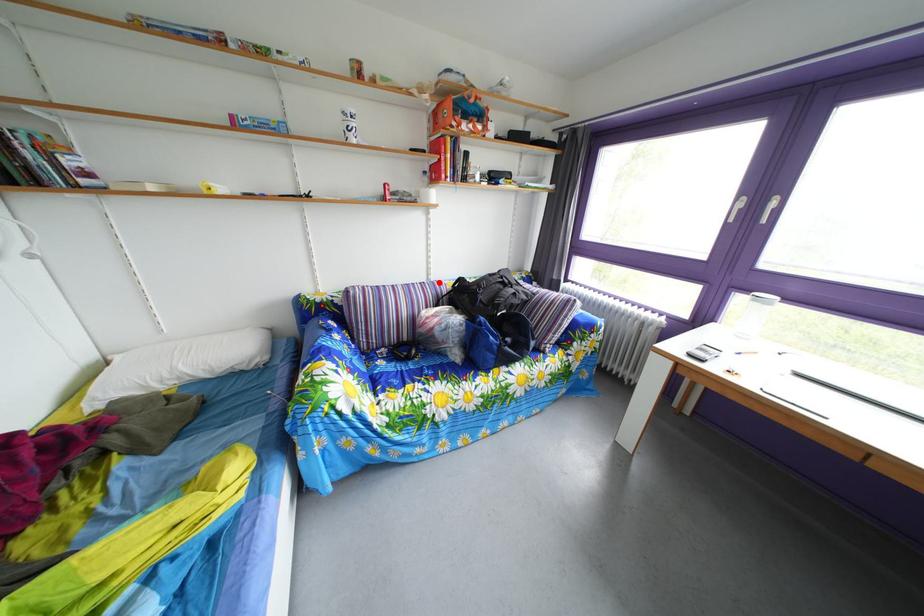
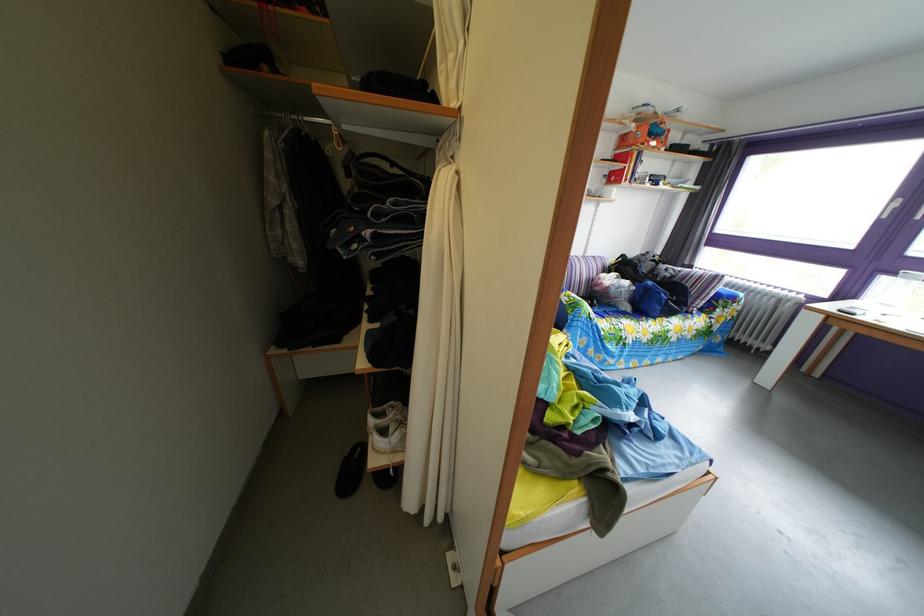
Find the pixel in the second image that matches the highlighted location in the first image.

(596, 261)